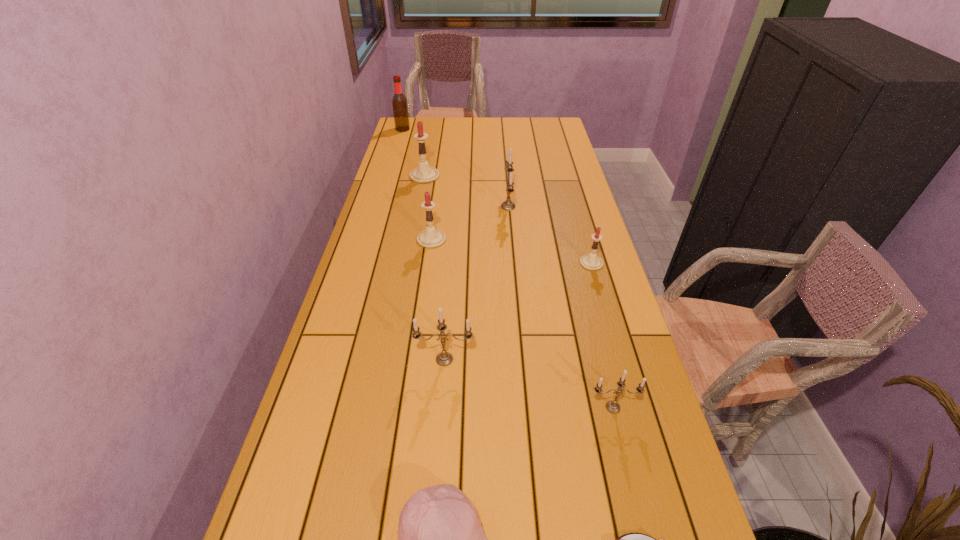
Locate an element on the screen. This screenshot has height=540, width=960. the nearest red candle is located at coordinates (591, 261).

This screenshot has height=540, width=960. What are the coordinates of `the third nearest candle` in the screenshot? It's located at (591, 261).

The height and width of the screenshot is (540, 960). In order to click on the nearest candle in this screenshot , I will do [613, 407].

You are a GUI agent. You are given a task and a screenshot of the screen. Output one action in this format:
    pyautogui.click(x=<x>, y=<y>)
    Task: Click on the smallest metallic candle
    
    Given the screenshot: What is the action you would take?
    tap(613, 407)

Locate an element on the screen. This screenshot has height=540, width=960. vacant space located on the front of the beer bottle is located at coordinates (399, 140).

The image size is (960, 540). Identify the location of free point located on the left of the farthest metallic candle. click(x=487, y=206).

I want to click on free space located on the right of the biggest red candle, so click(x=469, y=176).

I want to click on free space located on the right of the second biggest red candle, so click(545, 239).

Locate an element on the screen. vacant space located 0.160m on the front of the fifth farthest candle is located at coordinates (440, 426).

Locate an element on the screen. free region located on the front of the fifth nearest object is located at coordinates (612, 333).